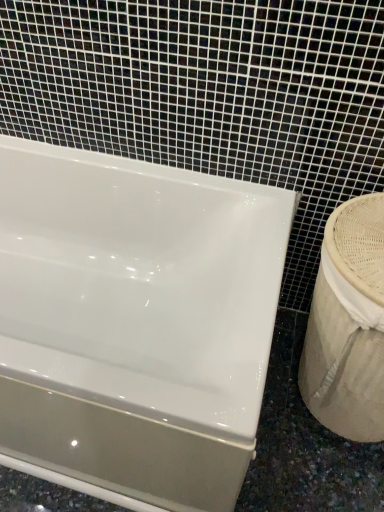
This screenshot has width=384, height=512. What do you see at coordinates (135, 321) in the screenshot? I see `glossy ceramic bathtub at upper left` at bounding box center [135, 321].

Measure the distance between glossy ceramic bathtub at upper left and camera.

The distance of glossy ceramic bathtub at upper left from camera is 28.66 inches.

Find the location of a particular element. glossy ceramic bathtub at upper left is located at coordinates (135, 321).

Measure the distance between white glossy sink at right and camera.

white glossy sink at right is 33.09 inches away from camera.

Locate an element on the screen. The height and width of the screenshot is (512, 384). white glossy sink at right is located at coordinates (347, 327).

Based on the photo, in order to face white glossy sink at right, should I rotate leftwards or rightwards?

Rotate right and turn 21.350 degrees.

This screenshot has height=512, width=384. What do you see at coordinates (347, 327) in the screenshot?
I see `white glossy sink at right` at bounding box center [347, 327].

The width and height of the screenshot is (384, 512). I want to click on glossy ceramic bathtub at upper left, so click(x=135, y=321).

Can you confirm if white glossy sink at right is positioned to the left of glossy ceramic bathtub at upper left?

In fact, white glossy sink at right is to the right of glossy ceramic bathtub at upper left.

Which object is closer to the camera, white glossy sink at right or glossy ceramic bathtub at upper left?

glossy ceramic bathtub at upper left is more forward.

Is point (380, 356) closer to camera compared to point (117, 326)?

Yes, point (380, 356) is in front of point (117, 326).

From the image's perspective, is white glossy sink at right on top of glossy ceramic bathtub at upper left?

Incorrect, from the image's perspective, white glossy sink at right is lower than glossy ceramic bathtub at upper left.

Consider the image. From a real-world perspective, is white glossy sink at right positioned above or below glossy ceramic bathtub at upper left?

From a real-world perspective, white glossy sink at right is physically above glossy ceramic bathtub at upper left.

Between white glossy sink at right and glossy ceramic bathtub at upper left, which one has larger width?

glossy ceramic bathtub at upper left.

Considering the relative sizes of white glossy sink at right and glossy ceramic bathtub at upper left in the image provided, is white glossy sink at right taller than glossy ceramic bathtub at upper left?

Indeed, white glossy sink at right has a greater height compared to glossy ceramic bathtub at upper left.

Which of these two, white glossy sink at right or glossy ceramic bathtub at upper left, is bigger?

With larger size is glossy ceramic bathtub at upper left.

Would you say white glossy sink at right contains glossy ceramic bathtub at upper left?

No, glossy ceramic bathtub at upper left is not a part of white glossy sink at right.

Would you say white glossy sink at right is a long distance from glossy ceramic bathtub at upper left?

No, white glossy sink at right is in close proximity to glossy ceramic bathtub at upper left.

Is white glossy sink at right oriented towards glossy ceramic bathtub at upper left?

No, white glossy sink at right is not aimed at glossy ceramic bathtub at upper left.

Identify the location of bathtub above the white glossy sink at right (from the image's perspective). tap(135, 321).

Which object is positioned more to the left, glossy ceramic bathtub at upper left or white glossy sink at right?

glossy ceramic bathtub at upper left is more to the left.

Between glossy ceramic bathtub at upper left and white glossy sink at right, which one is positioned behind?

white glossy sink at right is further from the camera.

Is point (47, 270) less distant than point (334, 432)?

That is False.

From the image's perspective, between glossy ceramic bathtub at upper left and white glossy sink at right, which one is located above?

glossy ceramic bathtub at upper left.

From the picture: From a real-world perspective, which is physically above, glossy ceramic bathtub at upper left or white glossy sink at right?

white glossy sink at right is physically above.

Between glossy ceramic bathtub at upper left and white glossy sink at right, which one has smaller width?

Thinner between the two is white glossy sink at right.

Looking at this image, which of these two, glossy ceramic bathtub at upper left or white glossy sink at right, stands taller?

With more height is white glossy sink at right.

Between glossy ceramic bathtub at upper left and white glossy sink at right, which one has smaller size?

Smaller between the two is white glossy sink at right.

Is glossy ceramic bathtub at upper left located outside white glossy sink at right?

Yes, glossy ceramic bathtub at upper left is not within white glossy sink at right.

Is glossy ceramic bathtub at upper left in contact with white glossy sink at right?

No, glossy ceramic bathtub at upper left is not next to white glossy sink at right.

Looking at this image, is glossy ceramic bathtub at upper left looking in the opposite direction of white glossy sink at right?

No, white glossy sink at right is not at the back of glossy ceramic bathtub at upper left.

How many degrees apart are the facing directions of glossy ceramic bathtub at upper left and white glossy sink at right?

0.838 degrees.

Find the location of a particular element. The height and width of the screenshot is (512, 384). sink located on the right of glossy ceramic bathtub at upper left is located at coordinates (347, 327).

The image size is (384, 512). Find the location of `sink positioned vertically above the glossy ceramic bathtub at upper left (from a real-world perspective)`. sink positioned vertically above the glossy ceramic bathtub at upper left (from a real-world perspective) is located at coordinates (347, 327).

What are the coordinates of `sink below the glossy ceramic bathtub at upper left (from the image's perspective)` in the screenshot? It's located at (347, 327).